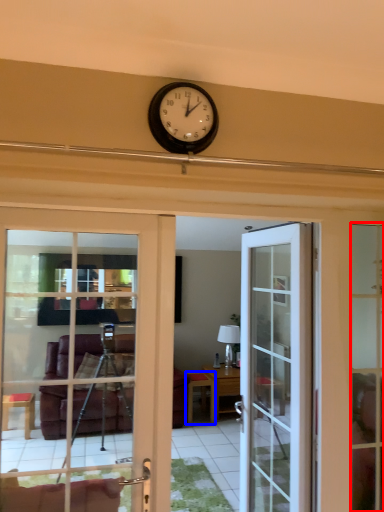
Question: Which of the following is the farthest to the observer, window frame (highlighted by a red box) or table (highlighted by a blue box)?

Choices:
 (A) window frame
 (B) table

Answer: (B)